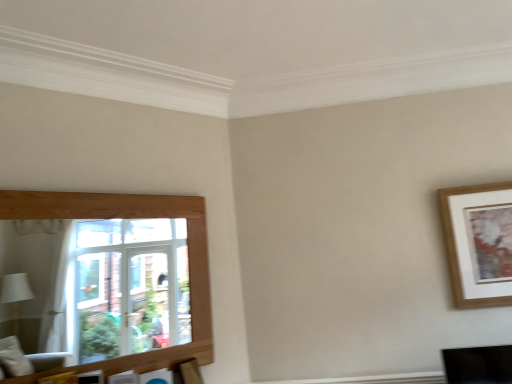
Measure the distance between wooden picture frame at upper right and camera.

The depth of wooden picture frame at upper right is 7.50 feet.

Describe the element at coordinates (478, 243) in the screenshot. I see `wooden picture frame at upper right` at that location.

Identify the location of wooden picture frame at upper right. (478, 243).

Identify the location of wooden picture frame at upper right. (478, 243).